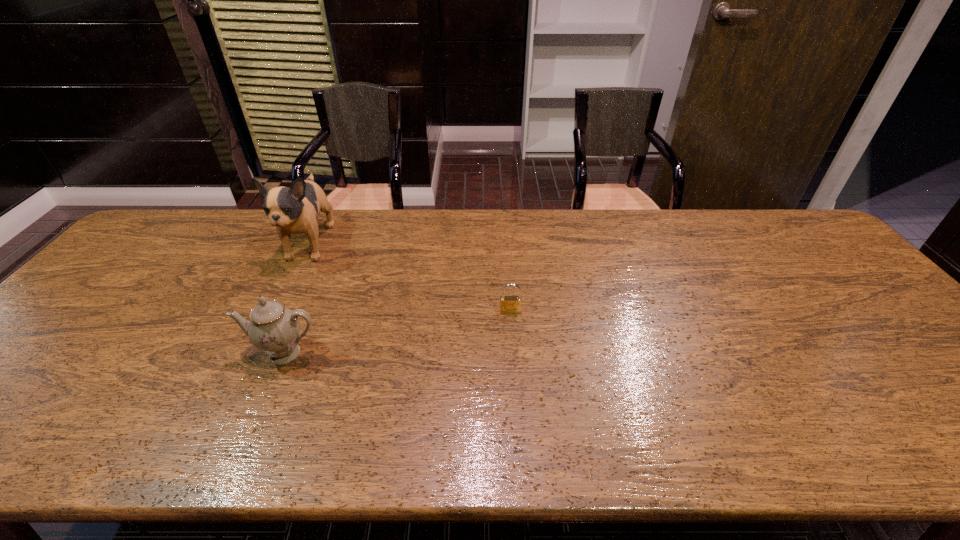
Image resolution: width=960 pixels, height=540 pixels. Identify the location of free point between the second nearest object and the tallest object. (410, 278).

The height and width of the screenshot is (540, 960). Find the location of `vacant space in between the puppy and the second nearest object`. vacant space in between the puppy and the second nearest object is located at coordinates (410, 278).

Find the location of a particular element. The height and width of the screenshot is (540, 960). free point between the rightmost object and the second tallest object is located at coordinates (397, 332).

Identify which object is located as the nearest to the second shortest object. Please provide its 2D coordinates. Your answer should be formatted as a tuple, i.e. [(x, y)], where the tuple contains the x and y coordinates of a point satisfying the conditions above.

[(295, 210)]

The image size is (960, 540). Identify the location of object that is the closest to the chinaware. point(295,210).